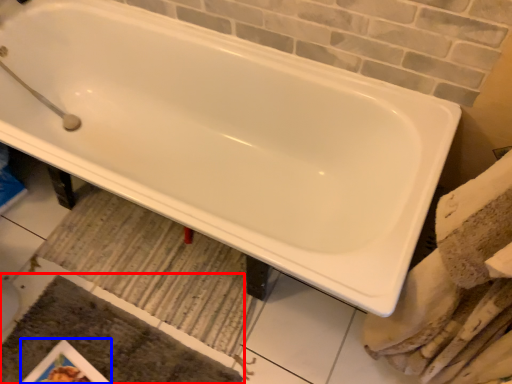
Question: Which of the following is the farthest to the observer, bath mat (highlighted by a red box) or magazine (highlighted by a blue box)?

Choices:
 (A) bath mat
 (B) magazine

Answer: (B)